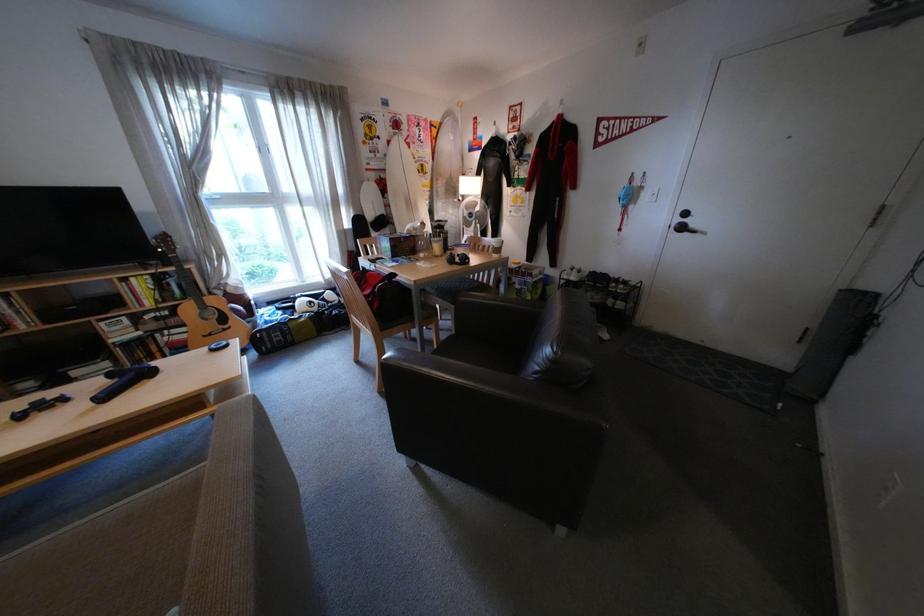
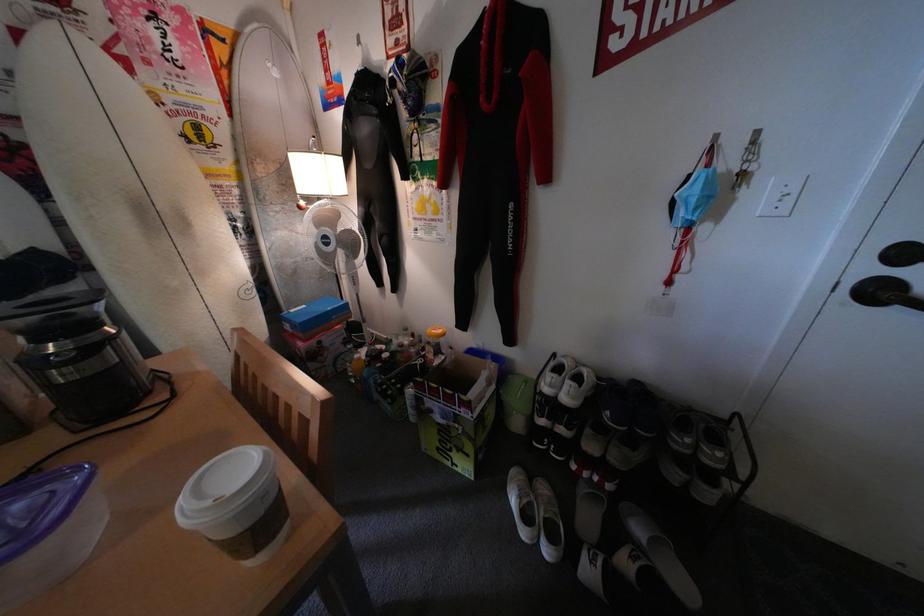
Question: What movement of the cameraman would produce the second image?

Choices:
 (A) Left
 (B) Right
 (C) Forward
 (D) Backward

Answer: (C)